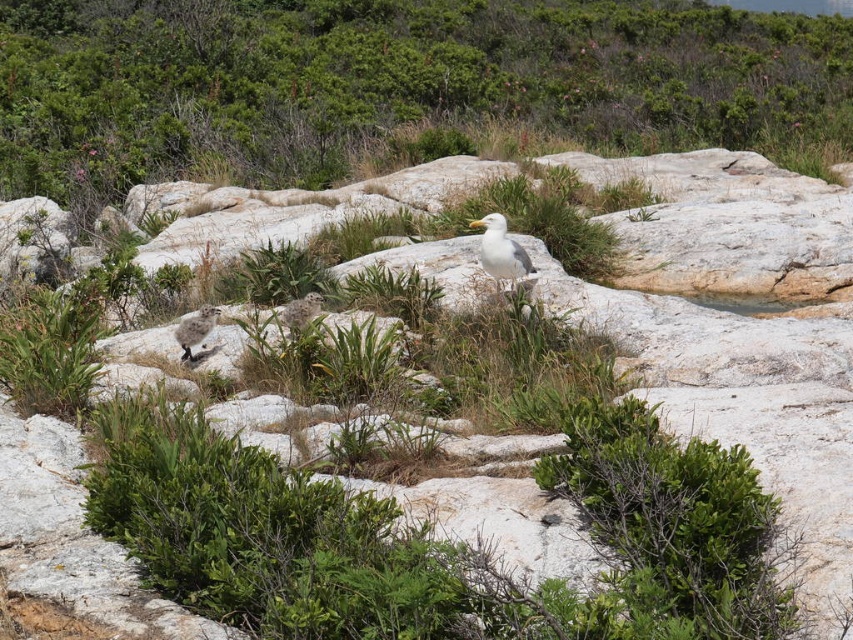
Question: Which object appears farthest from the camera in this image?

Choices:
 (A) speckled feathered chick at lower left
 (B) green leafy shrubs at upper center
 (C) white feathered bird at center
 (D) white fluffy bird at center

Answer: (B)

Question: Can you confirm if white feathered bird at center is smaller than speckled feathered chick at lower left?

Choices:
 (A) yes
 (B) no

Answer: (B)

Question: Among these points, which one is farthest from the camera?

Choices:
 (A) (589, 118)
 (B) (503, 244)
 (C) (300, 308)

Answer: (A)

Question: Is speckled feathered chick at lower left further to the viewer compared to white fluffy bird at center?

Choices:
 (A) yes
 (B) no

Answer: (A)

Question: Is green leafy shrubs at upper center to the right of white feathered bird at center from the viewer's perspective?

Choices:
 (A) no
 (B) yes

Answer: (A)

Question: Which object appears farthest from the camera in this image?

Choices:
 (A) white fluffy bird at center
 (B) speckled feathered chick at lower left
 (C) green leafy shrubs at upper center

Answer: (C)